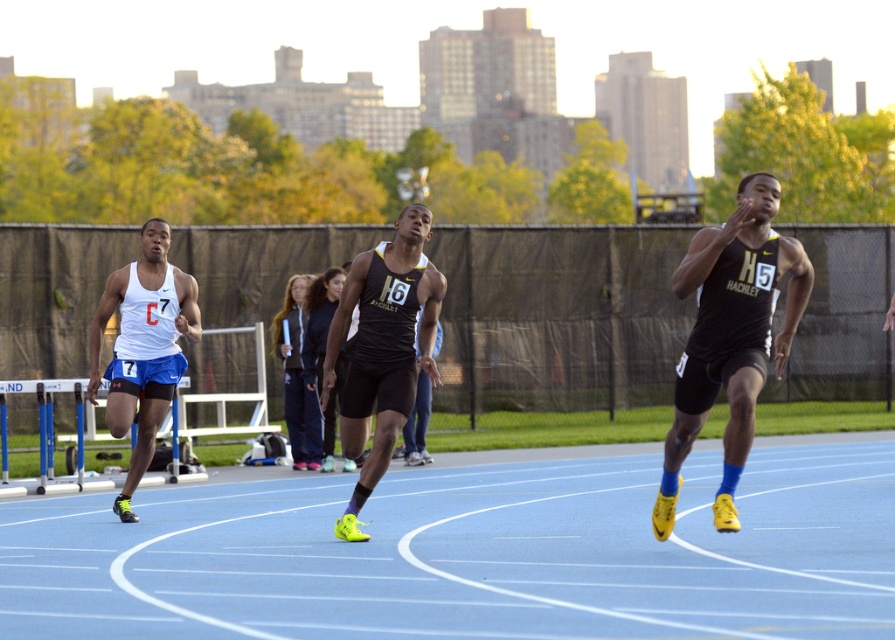
Which is more to the right, blue rubber track at center or white matte singlet at left?

blue rubber track at center is more to the right.

Does blue rubber track at center lie in front of white matte singlet at left?

Yes, blue rubber track at center is in front of white matte singlet at left.

Describe the element at coordinates (472, 554) in the screenshot. I see `blue rubber track at center` at that location.

Where is `blue rubber track at center`? The height and width of the screenshot is (640, 895). blue rubber track at center is located at coordinates (472, 554).

Which of these two, black matte running shoe at right or white matte singlet at left, stands taller?

With more height is white matte singlet at left.

Does black matte running shoe at right have a lesser height compared to white matte singlet at left?

Indeed, black matte running shoe at right has a lesser height compared to white matte singlet at left.

What are the coordinates of `black matte running shoe at right` in the screenshot? It's located at (730, 337).

You are a GUI agent. You are given a task and a screenshot of the screen. Output one action in this format:
    pyautogui.click(x=<x>, y=<y>)
    Task: Click on the black matte running shoe at right
    The image size is (895, 640).
    Given the screenshot: What is the action you would take?
    pyautogui.click(x=730, y=337)

Does point (359, 291) come behind point (294, 372)?

No, (359, 291) is in front of (294, 372).

Is point (398, 262) closer to viewer compared to point (299, 456)?

Yes.

Locate an element on the screen. matte black singlet at center is located at coordinates (382, 348).